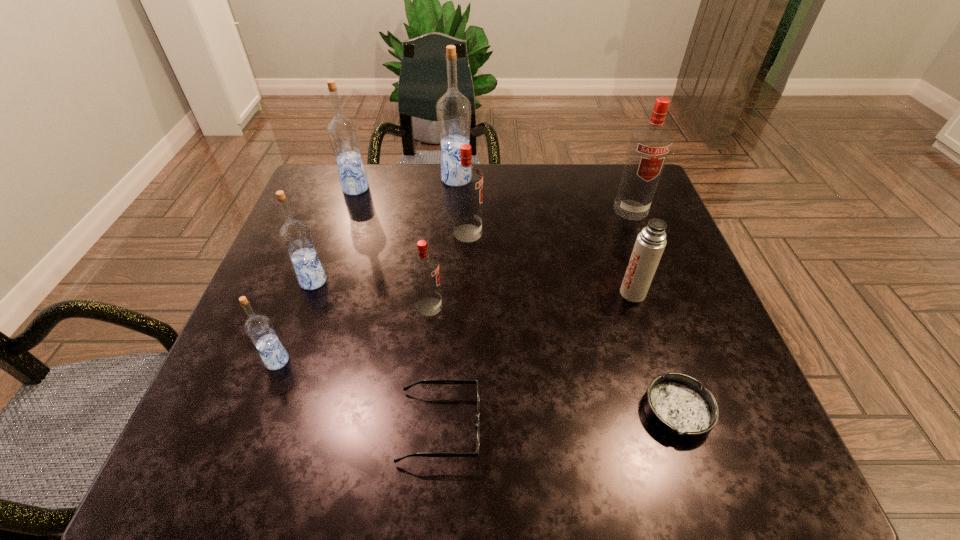
Where is `vodka that is at the right edge`? The width and height of the screenshot is (960, 540). vodka that is at the right edge is located at coordinates (650, 144).

In order to click on thermos bottle that is at the right edge in this screenshot , I will do `click(651, 241)`.

The image size is (960, 540). Find the location of `ashtray that is at the right edge`. ashtray that is at the right edge is located at coordinates (676, 404).

The width and height of the screenshot is (960, 540). I want to click on object present at the far left corner, so (x=342, y=132).

You are a GUI agent. You are given a task and a screenshot of the screen. Output one action in this format:
    pyautogui.click(x=<x>, y=<y>)
    Task: Click on the object that is at the far right corner
    
    Given the screenshot: What is the action you would take?
    pyautogui.click(x=650, y=144)

The width and height of the screenshot is (960, 540). Identify the location of object present at the near right corner. (676, 404).

In the image, there is a desktop. Where is `vacant region at the far edge`? Image resolution: width=960 pixels, height=540 pixels. vacant region at the far edge is located at coordinates (498, 180).

This screenshot has width=960, height=540. I want to click on vacant space at the near edge of the desktop, so click(x=358, y=457).

This screenshot has width=960, height=540. In the image, there is a desktop. In order to click on blank space at the left edge in this screenshot , I will do click(x=300, y=346).

Find the location of `free location at the right edge of the desktop`. free location at the right edge of the desktop is located at coordinates (698, 317).